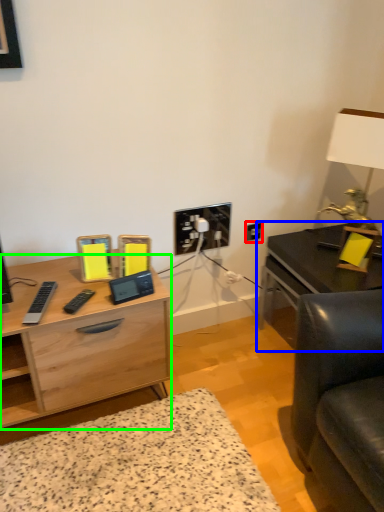
Question: Considering the real-world distances, which object is farthest from electric outlet (highlighted by a red box)? table (highlighted by a blue box) or desk (highlighted by a green box)?

Choices:
 (A) table
 (B) desk

Answer: (B)